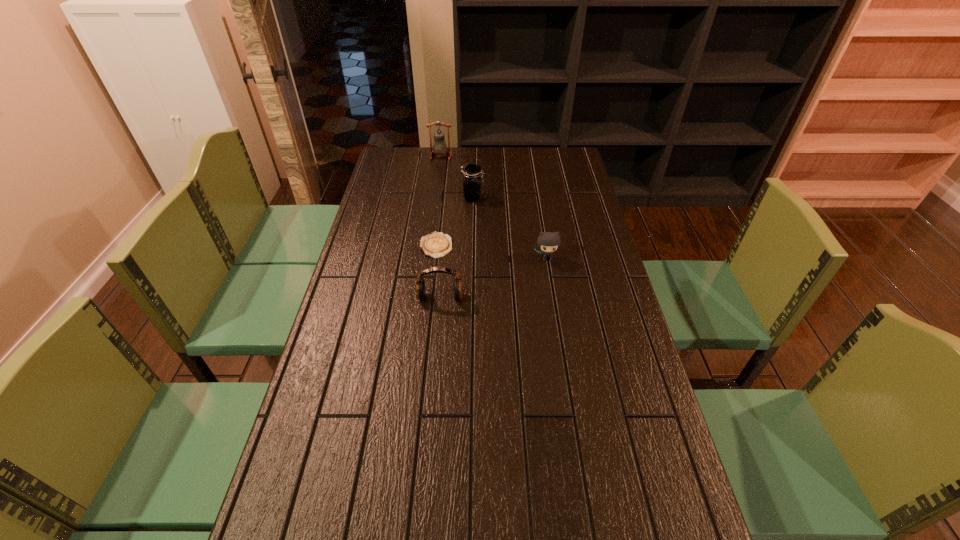
Find the location of a particular element. The height and width of the screenshot is (540, 960). free space between the bell and the shortest object is located at coordinates (439, 201).

Identify the location of free space between the nearest object and the rightmost object. This screenshot has width=960, height=540. (493, 278).

Image resolution: width=960 pixels, height=540 pixels. What are the coordinates of `empty location between the bell and the jar` in the screenshot? It's located at (457, 177).

You are a GUI agent. You are given a task and a screenshot of the screen. Output one action in this format:
    pyautogui.click(x=<x>, y=<y>)
    Task: Click on the free space between the farthest object and the shortest object
    The width and height of the screenshot is (960, 540).
    Given the screenshot: What is the action you would take?
    pyautogui.click(x=439, y=201)

Find the location of a particular element. The image size is (960, 540). vacant space that's between the rightmost object and the second farthest object is located at coordinates (510, 228).

Locate an element on the screen. This screenshot has height=540, width=960. vacant point located between the jar and the farthest object is located at coordinates (457, 177).

Where is `vacant space that is in between the headset and the bell`? The width and height of the screenshot is (960, 540). vacant space that is in between the headset and the bell is located at coordinates (441, 227).

At what (x,y) coordinates should I click in order to perform the action: click on the third closest object to the shortest object. Please return your answer as a coordinate pair (x, y). The image size is (960, 540). Looking at the image, I should click on (548, 242).

Locate an element on the screen. This screenshot has width=960, height=540. object that is the nearest to the jar is located at coordinates (436, 245).